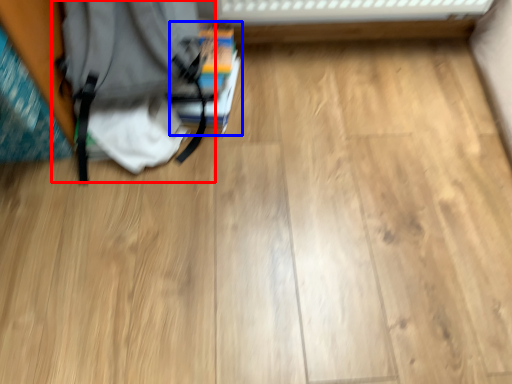
Question: Which object is further to the camera taking this photo, backpack (highlighted by a red box) or book (highlighted by a blue box)?

Choices:
 (A) backpack
 (B) book

Answer: (B)